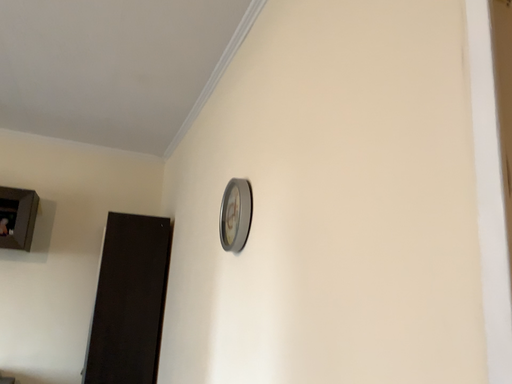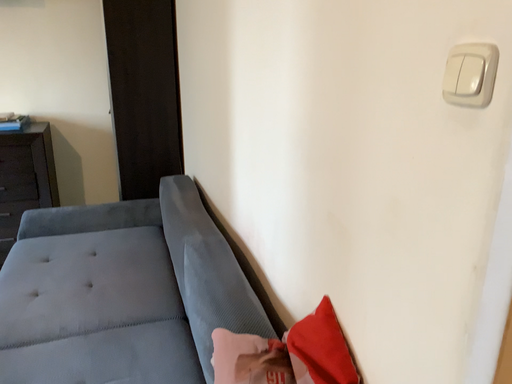
Question: Which way did the camera rotate in the video?

Choices:
 (A) rotated downward
 (B) rotated upward

Answer: (A)